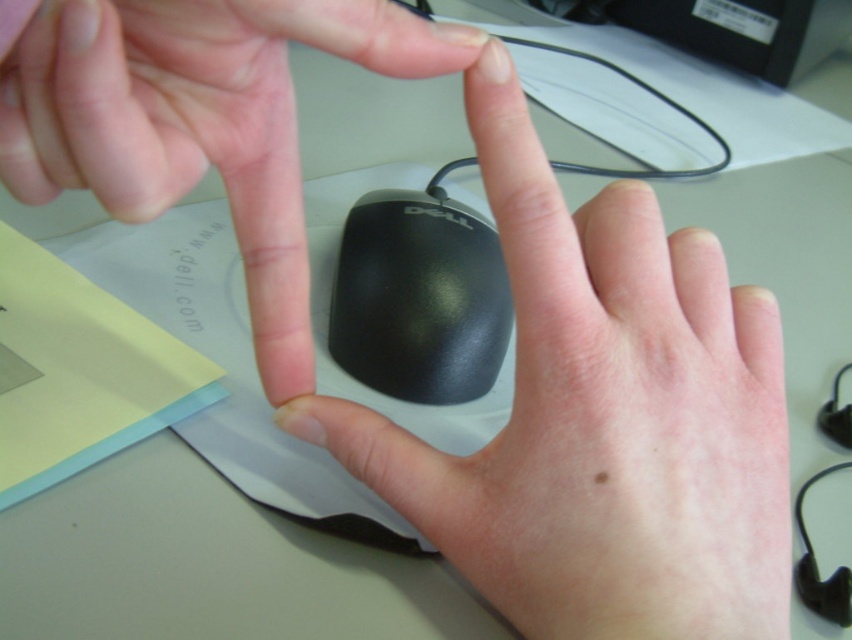
In the scene shown: You are a photographer trying to capture a closeup of the black glossy mouse at center and the smooth skin hand at center. Since both are at the center, which one will appear larger in the photo?

The smooth skin hand at center is taller than the black glossy mouse at center, so it will appear larger in the photo.

You are a photographer setting up a closeup shot of the hands and mouse. The client wants to ensure that the matte black mouse at center is clearly visible above the smooth skin hand at center. Based on the scene description, will this be achievable?

Yes, the matte black mouse at center is positioned above the smooth skin hand at center, so it will be clearly visible in the photograph.

Consider the image. You are setting up a workstation and want to place both the matte black mouse at center and the black glossy mouse at center on your desk. Given that the desk has a 5 inch wide shelf, will both mice fit side by side on the shelf?

The distance between the matte black mouse at center and black glossy mouse at center is 4.91 inches, which is slightly less than the 5 inch width of the shelf. Therefore, both mice can fit side by side on the shelf.